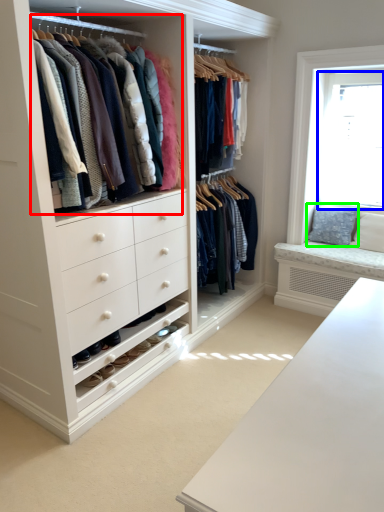
Question: Which is farther away from closet (highlighted by a red box)? bay window (highlighted by a blue box) or pillow (highlighted by a green box)?

Choices:
 (A) bay window
 (B) pillow

Answer: (B)